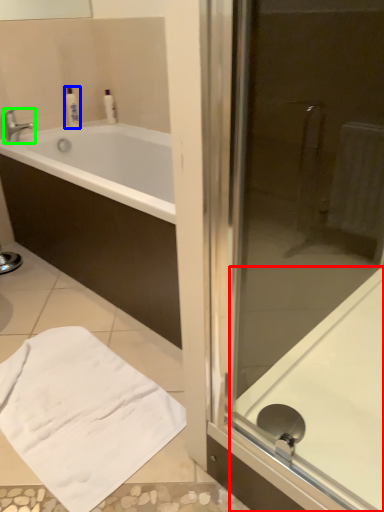
Question: Based on their relative distances, which object is nearer to bath (highlighted by a red box)? Choose from toiletry (highlighted by a blue box) and tap (highlighted by a green box).

Choices:
 (A) toiletry
 (B) tap

Answer: (B)